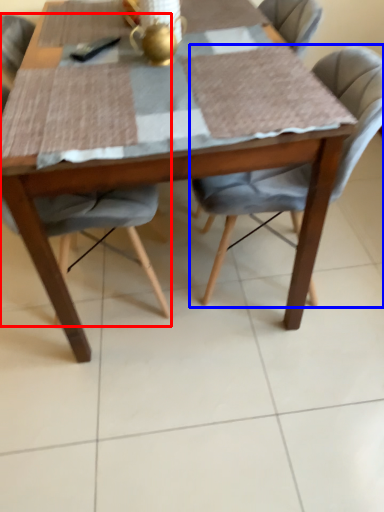
Question: Which of the following is the closest to the observer, chair (highlighted by a red box) or chair (highlighted by a blue box)?

Choices:
 (A) chair
 (B) chair

Answer: (A)